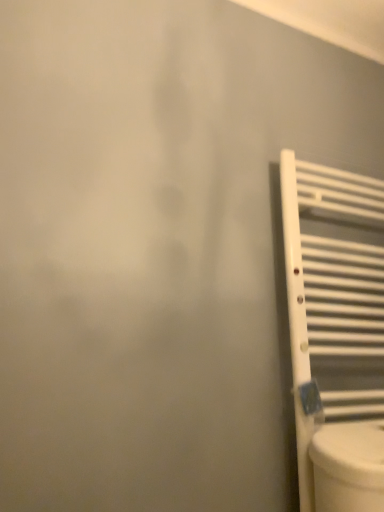
Question: From a real-world perspective, is white matte radiator at right located beneath white glossy toilet at lower right?

Choices:
 (A) yes
 (B) no

Answer: (B)

Question: Does white matte radiator at right lie behind white glossy toilet at lower right?

Choices:
 (A) no
 (B) yes

Answer: (B)

Question: From a real-world perspective, is white matte radiator at right located higher than white glossy toilet at lower right?

Choices:
 (A) yes
 (B) no

Answer: (A)

Question: Is white matte radiator at right not inside white glossy toilet at lower right?

Choices:
 (A) yes
 (B) no

Answer: (A)

Question: Is white glossy toilet at lower right at the back of white matte radiator at right?

Choices:
 (A) no
 (B) yes

Answer: (B)

Question: Can you confirm if white matte radiator at right is bigger than white glossy toilet at lower right?

Choices:
 (A) yes
 (B) no

Answer: (A)

Question: Considering the relative sizes of white glossy toilet at lower right and white matte radiator at right in the image provided, is white glossy toilet at lower right shorter than white matte radiator at right?

Choices:
 (A) no
 (B) yes

Answer: (B)

Question: Is white glossy toilet at lower right bigger than white matte radiator at right?

Choices:
 (A) no
 (B) yes

Answer: (A)

Question: Is white glossy toilet at lower right turned away from white matte radiator at right?

Choices:
 (A) yes
 (B) no

Answer: (A)

Question: From the image's perspective, is white glossy toilet at lower right above white matte radiator at right?

Choices:
 (A) yes
 (B) no

Answer: (B)

Question: Can you confirm if white glossy toilet at lower right is wider than white matte radiator at right?

Choices:
 (A) yes
 (B) no

Answer: (A)

Question: From the image's perspective, is white glossy toilet at lower right located beneath white matte radiator at right?

Choices:
 (A) yes
 (B) no

Answer: (A)

Question: Is point (292, 167) positioned closer to the camera than point (347, 437)?

Choices:
 (A) closer
 (B) farther

Answer: (B)